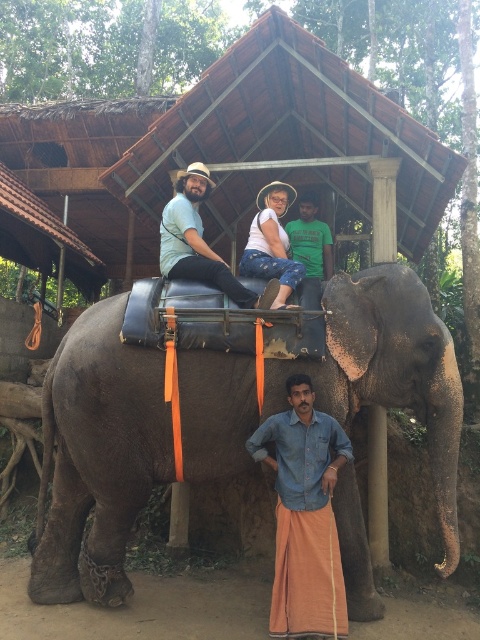
Question: Which point is closer to the camera?

Choices:
 (A) (303, 451)
 (B) (265, 294)

Answer: (A)

Question: Can you confirm if brown thatched roof at upper center is positioned below denim pants at center?

Choices:
 (A) no
 (B) yes

Answer: (A)

Question: Which point is closer to the camera taking this photo?

Choices:
 (A) (416, 244)
 (B) (192, 260)
 (C) (129, 429)

Answer: (C)

Question: Which point is farther to the camera?

Choices:
 (A) denim shirt at center
 (B) brown thatched roof at upper center
 (C) matte teal shirt at center

Answer: (B)

Question: Is brown thatched roof at upper center positioned in front of denim shirt at center?

Choices:
 (A) no
 (B) yes

Answer: (A)

Question: In this image, where is denim shirt at center located relative to denim pants at center?

Choices:
 (A) below
 (B) above

Answer: (A)